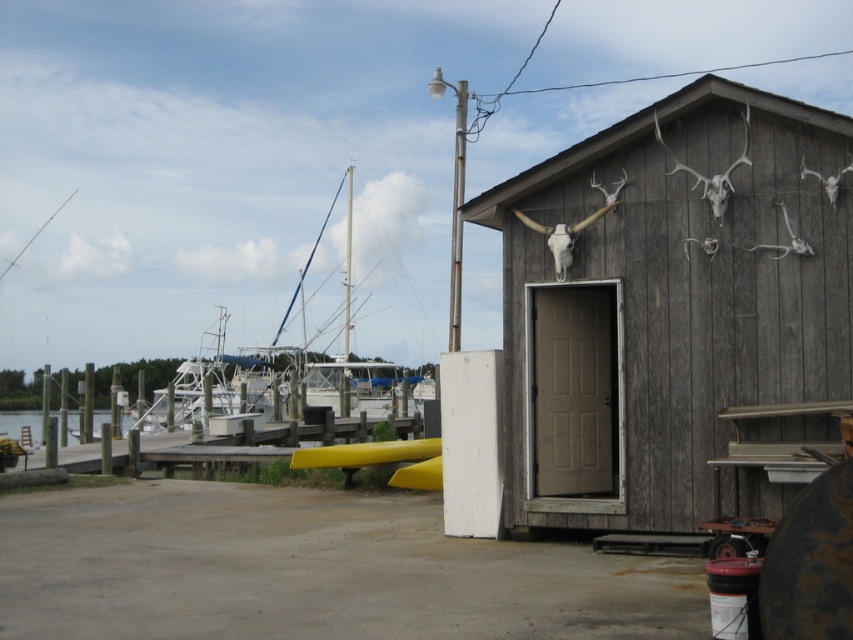
You are planning to launch a small boat from the yellow plastic dock at lower center. Considering the size of the dock and the clear water at dock left, will there be enough space to maneuver the boat into the water?

The yellow plastic dock at lower center has a smaller size compared to the clear water at dock left, so there might not be enough space to maneuver the boat into the water comfortably.

Based on the photo, you are planning to build a storage shed in your backyard and want to ensure it fits within the space allocated. The space can accommodate structures up to the size of the yellow plastic dock at lower center. Based on the image, will the weathered wood hut at center fit in the allocated space?

The weathered wood hut at center is smaller than the yellow plastic dock at lower center, so it will fit within the allocated space.